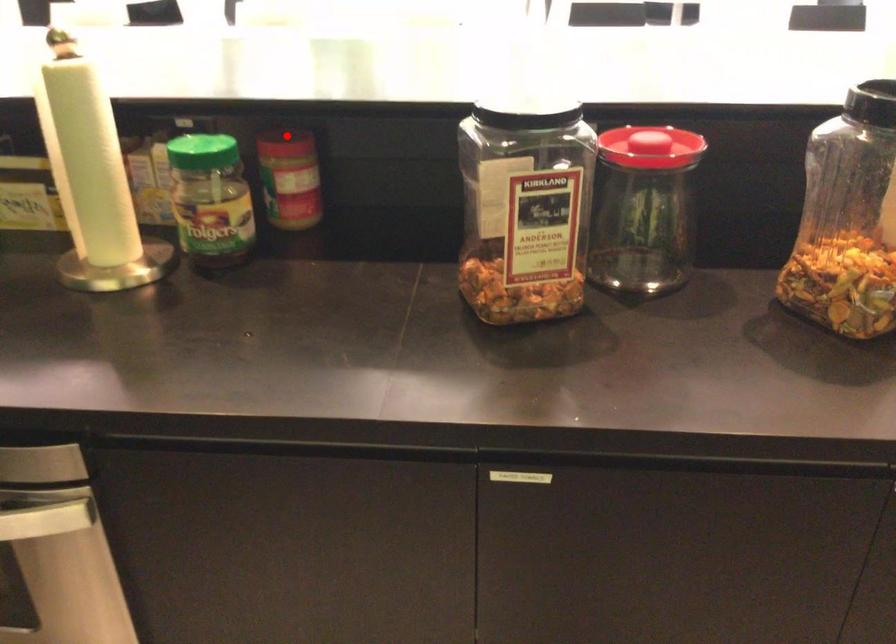
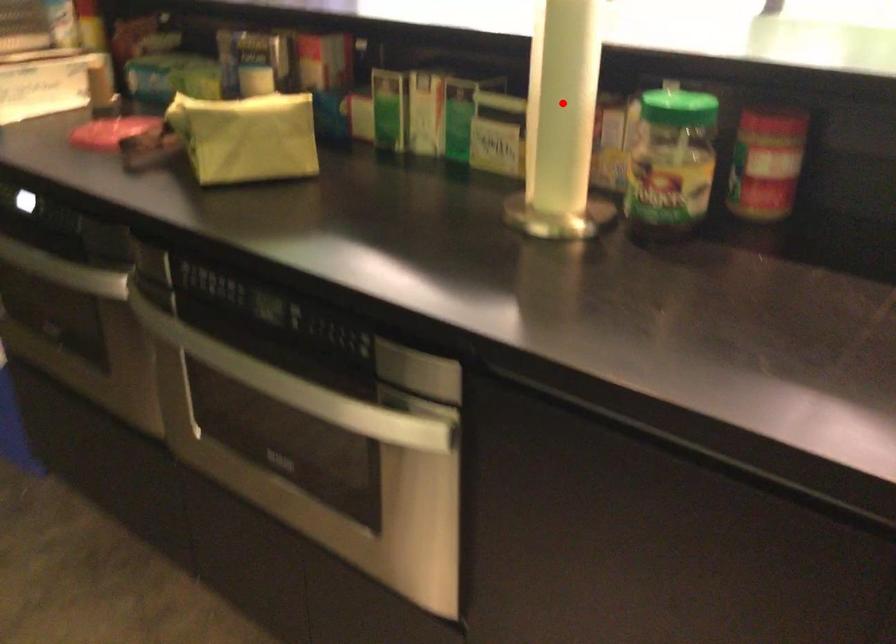
I am providing you with two images of the same scene from different viewpoints. A red point is marked on the first image and another point is marked on the second image. Do the highlighted points in image1 and image2 indicate the same real-world spot?

No